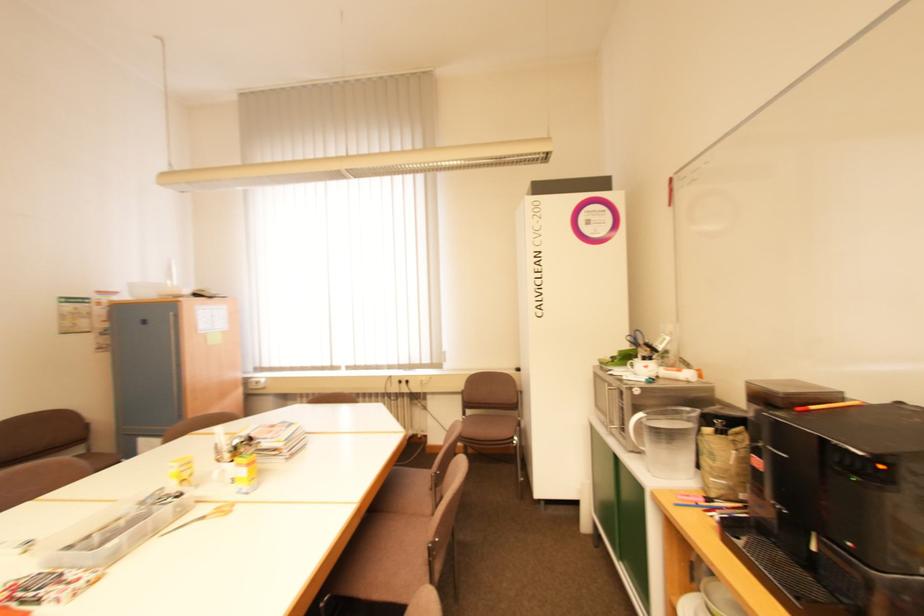
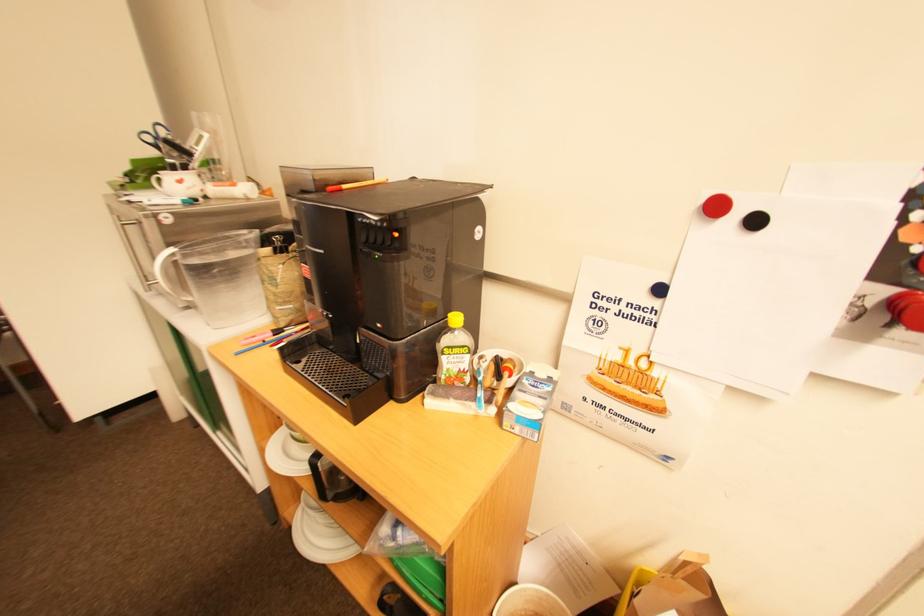
The first image is from the beginning of the video and the second image is from the end. How did the camera likely rotate when shooting the video?

The camera rotated toward right-down.